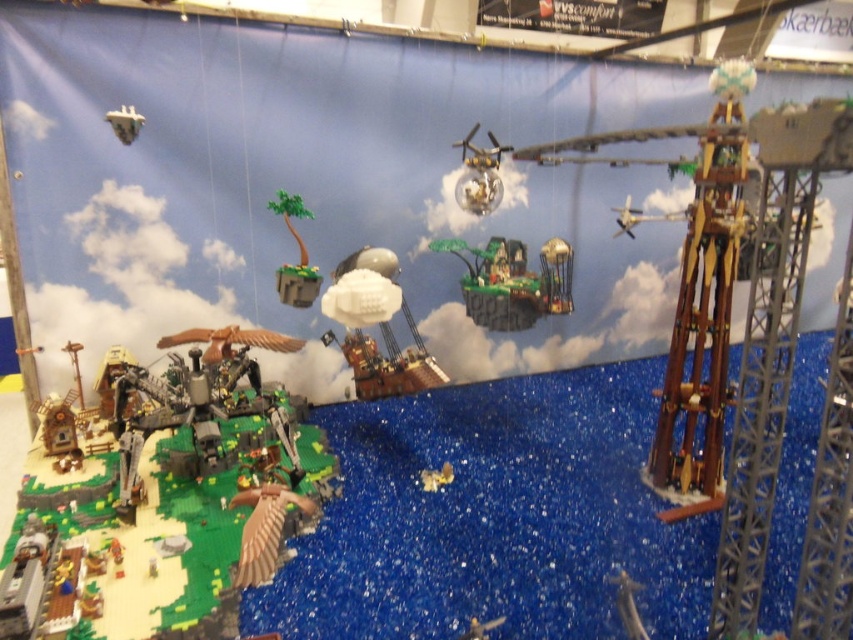
Does transparent plastic sphere at upper center have a larger size compared to green matte tree at center?

Incorrect, transparent plastic sphere at upper center is not larger than green matte tree at center.

Which is above, transparent plastic sphere at upper center or green matte tree at center?

transparent plastic sphere at upper center

Is point (490, 164) closer to camera compared to point (282, 195)?

No.

The height and width of the screenshot is (640, 853). In order to click on transparent plastic sphere at upper center in this screenshot , I will do `click(479, 173)`.

Is point (364, 337) less distant than point (486, 200)?

That is False.

Who is more distant from viewer, (x=389, y=374) or (x=491, y=170)?

Point (x=491, y=170)

Locate an element on the screen. Image resolution: width=853 pixels, height=640 pixels. white matte airship at center is located at coordinates (383, 337).

Between green plastic island at center and metallic silver spaceship at upper left, which one appears on the right side from the viewer's perspective?

green plastic island at center is more to the right.

Is green plastic island at center to the right of metallic silver spaceship at upper left from the viewer's perspective?

Correct, you'll find green plastic island at center to the right of metallic silver spaceship at upper left.

Locate an element on the screen. green plastic island at center is located at coordinates (512, 282).